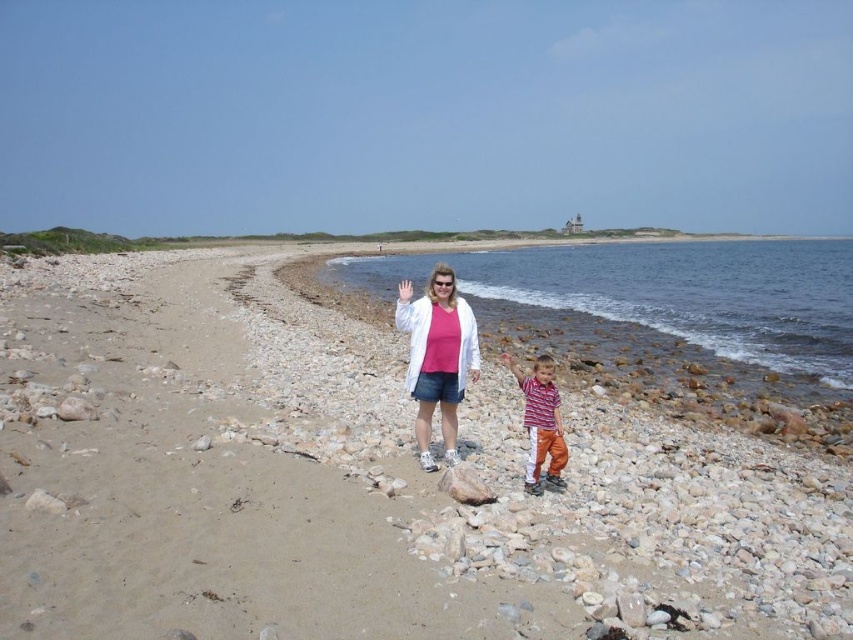
You are a photographer trying to capture a clear shot of both the matte white jacket at center and the striped cotton shirt at center. Since the camera can only focus on one subject at a time, which one should you choose to ensure the details are visible?

The matte white jacket at center is larger in size compared to the striped cotton shirt at center, so focusing on it would ensure better detail visibility.

In the scene shown: You are standing at the edge of the beach facing the water. You see the smooth pebbles at center and the striped cotton shirt at center. Which object is closer to your right side?

The striped cotton shirt at center is closer to your right side because the smooth pebbles at center are to the left of it.